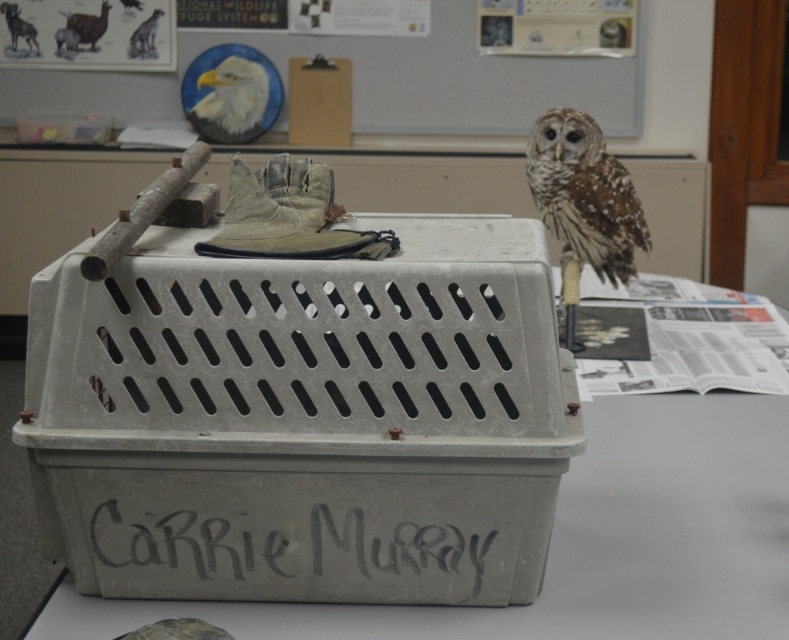
Question: Does gray plastic crate at center appear on the right side of brown speckled owl at upper right?

Choices:
 (A) no
 (B) yes

Answer: (B)

Question: Which point appears farthest from the camera in this image?

Choices:
 (A) (335, 636)
 (B) (593, 257)

Answer: (B)

Question: Where is gray plastic crate at center located in relation to brown speckled owl at upper right in the image?

Choices:
 (A) above
 (B) below

Answer: (B)

Question: Considering the relative positions of brown speckled feathers at upper right and brown speckled owl at upper right in the image provided, where is brown speckled feathers at upper right located with respect to brown speckled owl at upper right?

Choices:
 (A) left
 (B) right

Answer: (B)

Question: Which of these objects is positioned closest to the brown speckled owl at upper right?

Choices:
 (A) gray plastic crate at center
 (B) brown speckled feathers at upper right

Answer: (B)

Question: Which point appears farthest from the camera in this image?

Choices:
 (A) (255, 84)
 (B) (596, 125)
 (C) (621, 608)

Answer: (A)